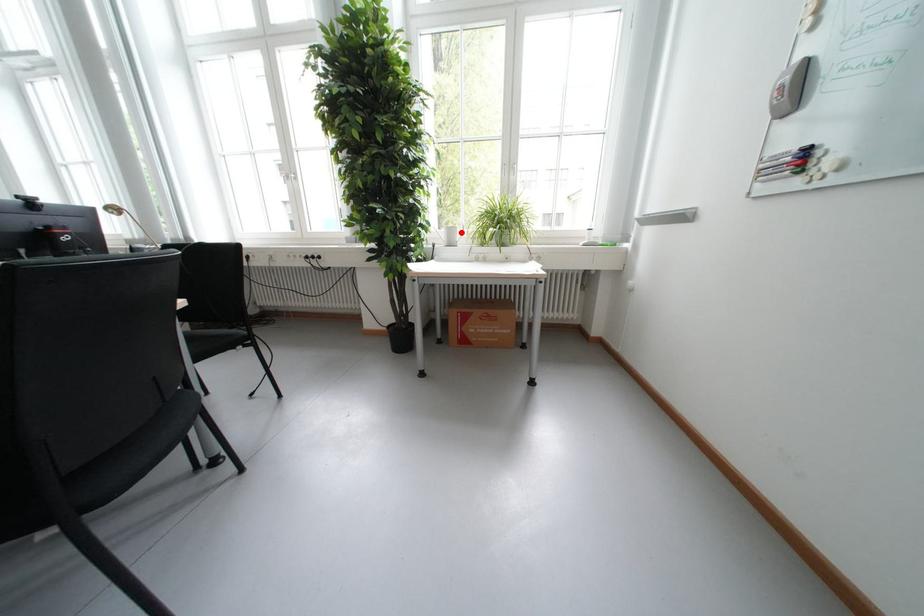
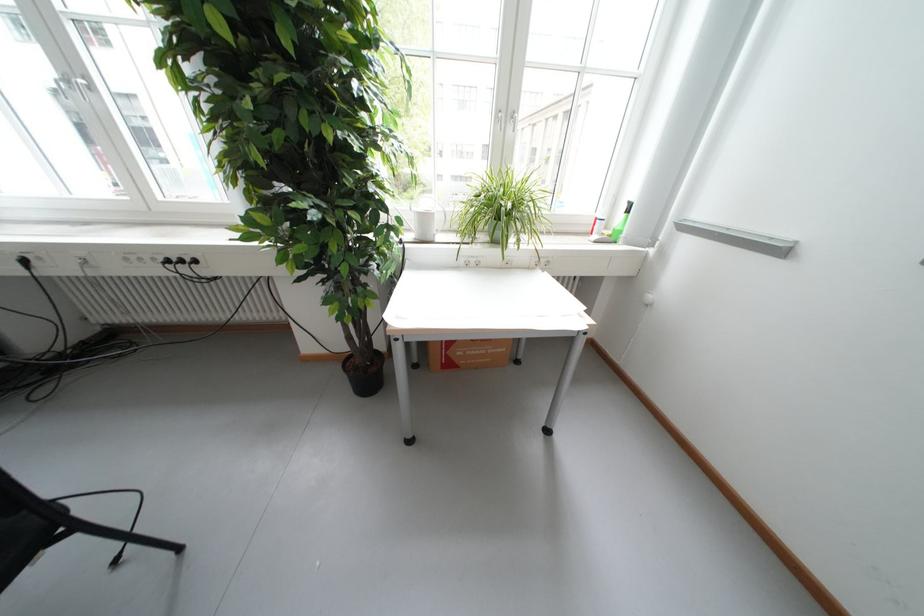
Where in the second image is the point corresponding to the highlighted location from the first image?

(435, 220)